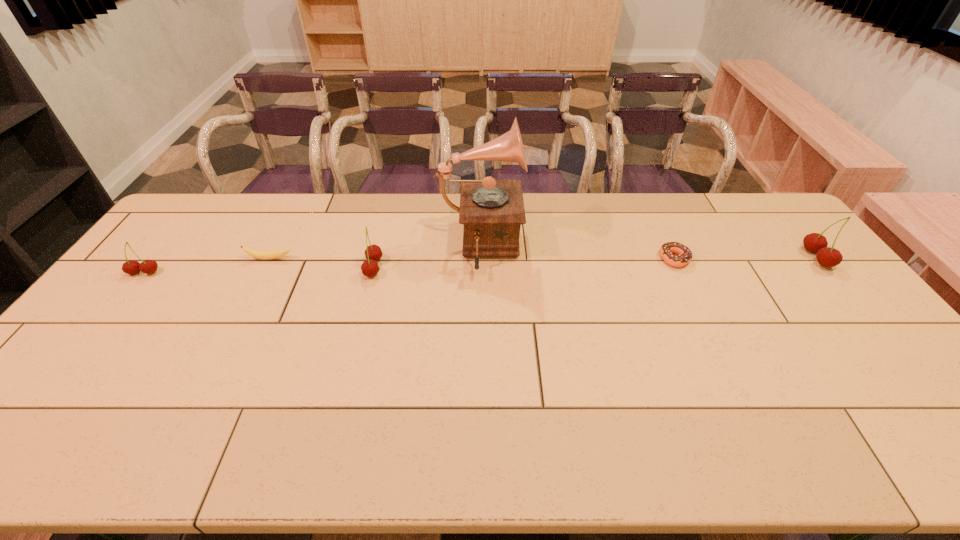
You are a GUI agent. You are given a task and a screenshot of the screen. Output one action in this format:
    pyautogui.click(x=<x>, y=<y>)
    Task: Click on the free space that satisfies the following two spatial constraints: 1. on the front side of the second object from right to left; 2. on the surface of the fourth object from right to left
    
    Given the screenshot: What is the action you would take?
    pyautogui.click(x=679, y=268)

You are a GUI agent. You are given a task and a screenshot of the screen. Output one action in this format:
    pyautogui.click(x=<x>, y=<y>)
    Task: Click on the free space that satisfies the following two spatial constraints: 1. on the horn of the third object from right to left; 2. on the back side of the shortest object
    Image resolution: width=960 pixels, height=540 pixels.
    Given the screenshot: What is the action you would take?
    pyautogui.click(x=480, y=259)

You are a GUI agent. You are given a task and a screenshot of the screen. Output one action in this format:
    pyautogui.click(x=<x>, y=<y>)
    Task: Click on the vacant space that satisfies the following two spatial constraints: 1. on the front side of the doughnut; 2. on the surface of the second tallest cherry
    The width and height of the screenshot is (960, 540).
    Given the screenshot: What is the action you would take?
    679,268

Where is `vacant space that satisfies the following two spatial constraints: 1. on the horn of the record player; 2. on the surface of the leftmost cherry`? vacant space that satisfies the following two spatial constraints: 1. on the horn of the record player; 2. on the surface of the leftmost cherry is located at coordinates (480, 273).

This screenshot has width=960, height=540. What are the coordinates of `vacant space that satisfies the following two spatial constraints: 1. on the horn of the tallest object; 2. on the right side of the shortest object` in the screenshot? It's located at (480, 259).

Where is `vacant area in the image that satisfies the following two spatial constraints: 1. on the horn of the fourth object from left to right; 2. on the surface of the leftmost object`? This screenshot has width=960, height=540. vacant area in the image that satisfies the following two spatial constraints: 1. on the horn of the fourth object from left to right; 2. on the surface of the leftmost object is located at coordinates (480, 273).

The width and height of the screenshot is (960, 540). Identify the location of free space that satisfies the following two spatial constraints: 1. on the surface of the rightmost cherry; 2. on the surface of the shortest cherry. (828, 273).

Locate an element on the screen. vacant point that satisfies the following two spatial constraints: 1. on the horn of the second object from right to left; 2. on the right side of the record player is located at coordinates (480, 259).

Image resolution: width=960 pixels, height=540 pixels. What are the coordinates of `vacant region that satisfies the following two spatial constraints: 1. on the horn of the tallest object; 2. on the surface of the leftmost object` in the screenshot? It's located at (480, 273).